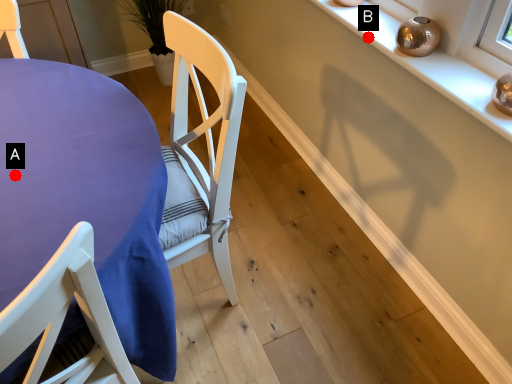
Question: Two points are circled on the image, labeled by A and B beside each circle. Which point is further to the camera?

Choices:
 (A) A is further
 (B) B is further

Answer: (B)